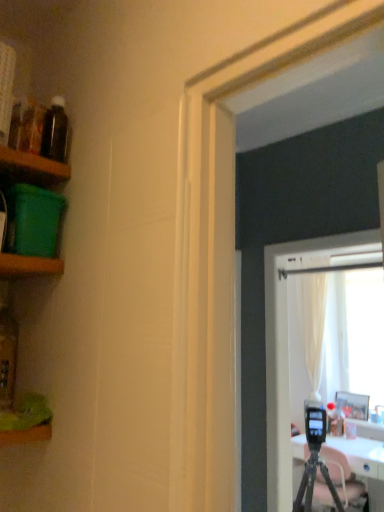
Question: Is point (3, 360) positioned closer to the camera than point (41, 266)?

Choices:
 (A) farther
 (B) closer

Answer: (A)

Question: Based on their sizes in the image, would you say translucent glass bottle at left, the second bottle in the right-to-left sequence, is bigger or smaller than green wood shelf at left, the 1th shelf ordered from the bottom?

Choices:
 (A) small
 (B) big

Answer: (A)

Question: Based on their relative distances, which object is farther from the black matte tripod at lower right?

Choices:
 (A) translucent glass bottle at left, which is counted as the second bottle, starting from the top
 (B) green plastic container at left, which ranks as the third shelf in bottom-to-top order
 (C) wooden picture frame at right
 (D) translucent glass bottle at upper left, the 2th bottle ordered from the bottom
 (E) green plastic container at left, which appears as the second shelf when viewed from the top

Answer: (D)

Question: Based on their relative distances, which object is nearer to the black matte tripod at lower right?

Choices:
 (A) translucent glass bottle at upper left, which is the 1th bottle in right-to-left order
 (B) translucent glass bottle at left, placed as the first bottle when sorted from left to right
 (C) wooden picture frame at right
 (D) green plastic container at left, which appears as the second shelf when viewed from the top
 (E) green plastic container at left, the 1th shelf in the top-to-bottom sequence

Answer: (C)